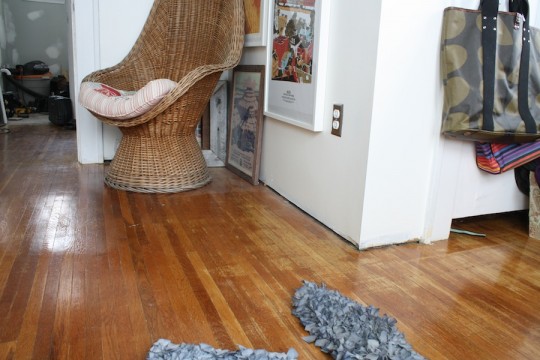
Locate an element on the screen. The width and height of the screenshot is (540, 360). orange wooden floor with rectangle vertical boxes is located at coordinates (195, 250).